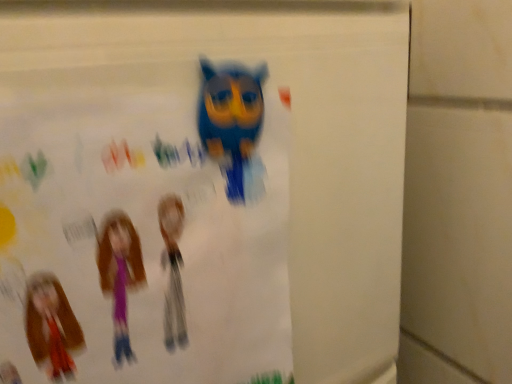
Describe the element at coordinates (233, 126) in the screenshot. I see `blue matte owl at upper center` at that location.

The height and width of the screenshot is (384, 512). What are the coordinates of `blue matte owl at upper center` in the screenshot? It's located at (233, 126).

Measure the distance between matte paper poster at upper center and camera.

The distance of matte paper poster at upper center from camera is 18.77 centimeters.

The height and width of the screenshot is (384, 512). Describe the element at coordinates (146, 233) in the screenshot. I see `matte paper poster at upper center` at that location.

In order to click on matte paper poster at upper center in this screenshot , I will do `click(146, 233)`.

Where is `blue matte owl at upper center`? The height and width of the screenshot is (384, 512). blue matte owl at upper center is located at coordinates (233, 126).

Between matte paper poster at upper center and blue matte owl at upper center, which one appears on the right side from the viewer's perspective?

From the viewer's perspective, blue matte owl at upper center appears more on the right side.

Is matte paper poster at upper center closer to camera compared to blue matte owl at upper center?

Yes.

Does point (143, 143) come farther from viewer compared to point (258, 126)?

No.

From the image's perspective, which is below, matte paper poster at upper center or blue matte owl at upper center?

From the image's view, matte paper poster at upper center is below.

From a real-world perspective, is matte paper poster at upper center below blue matte owl at upper center?

Indeed, from a real-world perspective, matte paper poster at upper center is positioned beneath blue matte owl at upper center.

Does matte paper poster at upper center have a lesser width compared to blue matte owl at upper center?

Incorrect, the width of matte paper poster at upper center is not less than that of blue matte owl at upper center.

Based on the photo, which of these two, matte paper poster at upper center or blue matte owl at upper center, stands shorter?

blue matte owl at upper center is shorter.

Who is bigger, matte paper poster at upper center or blue matte owl at upper center?

matte paper poster at upper center.

From the picture: Is matte paper poster at upper center positioned beyond the bounds of blue matte owl at upper center?

matte paper poster at upper center is positioned outside blue matte owl at upper center.

Is the surface of matte paper poster at upper center in direct contact with blue matte owl at upper center?

Yes, the surface of matte paper poster at upper center is in contact with blue matte owl at upper center.

Is matte paper poster at upper center aimed at blue matte owl at upper center?

Yes, matte paper poster at upper center is turned towards blue matte owl at upper center.

Can you tell me how much matte paper poster at upper center and blue matte owl at upper center differ in facing direction?

They differ by 0.00366 degrees in their facing directions.

The image size is (512, 384). In order to click on poster on the left of the blue matte owl at upper center in this screenshot , I will do `click(146, 233)`.

Considering the positions of objects blue matte owl at upper center and matte paper poster at upper center in the image provided, who is more to the right, blue matte owl at upper center or matte paper poster at upper center?

From the viewer's perspective, blue matte owl at upper center appears more on the right side.

Consider the image. Is blue matte owl at upper center closer to camera compared to matte paper poster at upper center?

No, it is behind matte paper poster at upper center.

Considering the points (242, 132) and (140, 326), which point is in front, point (242, 132) or point (140, 326)?

The point (140, 326) is more forward.

From the image's perspective, which is below, blue matte owl at upper center or matte paper poster at upper center?

matte paper poster at upper center.

From a real-world perspective, is blue matte owl at upper center beneath matte paper poster at upper center?

No, from a real-world perspective, blue matte owl at upper center is not under matte paper poster at upper center.

Between blue matte owl at upper center and matte paper poster at upper center, which one has smaller width?

blue matte owl at upper center is thinner.

Considering the sizes of objects blue matte owl at upper center and matte paper poster at upper center in the image provided, who is shorter, blue matte owl at upper center or matte paper poster at upper center?

Standing shorter between the two is blue matte owl at upper center.

Considering the relative sizes of blue matte owl at upper center and matte paper poster at upper center in the image provided, is blue matte owl at upper center bigger than matte paper poster at upper center?

No.

Would you say matte paper poster at upper center is part of blue matte owl at upper center's contents?

Definitely not — matte paper poster at upper center is not inside blue matte owl at upper center.

Are blue matte owl at upper center and matte paper poster at upper center far apart?

No, there isn't a large distance between blue matte owl at upper center and matte paper poster at upper center.

Is blue matte owl at upper center looking in the opposite direction of matte paper poster at upper center?

Correct, blue matte owl at upper center is looking away from matte paper poster at upper center.

Looking at this image, can you tell me how much blue matte owl at upper center and matte paper poster at upper center differ in facing direction?

blue matte owl at upper center and matte paper poster at upper center are facing 0.00366 degrees away from each other.

Image resolution: width=512 pixels, height=384 pixels. What are the coordinates of `poster that is in front of the blue matte owl at upper center` in the screenshot? It's located at (146, 233).

Identify the location of poster below the blue matte owl at upper center (from the image's perspective). This screenshot has width=512, height=384. (146, 233).

This screenshot has height=384, width=512. Find the location of `poster to the left of blue matte owl at upper center`. poster to the left of blue matte owl at upper center is located at coordinates (146, 233).